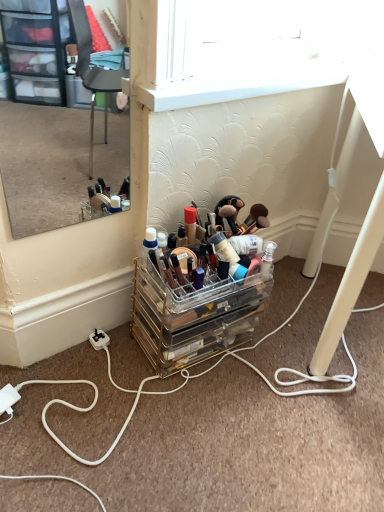
Question: From a real-world perspective, is white cord at lower left below clear acrylic makeup organizer at center?

Choices:
 (A) yes
 (B) no

Answer: (A)

Question: Can you confirm if white cord at lower left is wider than clear acrylic makeup organizer at center?

Choices:
 (A) no
 (B) yes

Answer: (B)

Question: Is white cord at lower left taller than clear acrylic makeup organizer at center?

Choices:
 (A) no
 (B) yes

Answer: (A)

Question: Is white cord at lower left facing towards clear acrylic makeup organizer at center?

Choices:
 (A) yes
 (B) no

Answer: (B)

Question: Is there a large distance between white cord at lower left and clear acrylic makeup organizer at center?

Choices:
 (A) yes
 (B) no

Answer: (B)

Question: Does white cord at lower left contain clear acrylic makeup organizer at center?

Choices:
 (A) no
 (B) yes

Answer: (A)

Question: Is clear acrylic makeup organizer at lower center inside white plastic power outlet at lower left?

Choices:
 (A) yes
 (B) no

Answer: (B)

Question: From a real-world perspective, is white plastic power outlet at lower left on clear acrylic makeup organizer at lower center?

Choices:
 (A) yes
 (B) no

Answer: (B)

Question: From a real-world perspective, is white plastic power outlet at lower left positioned under clear acrylic makeup organizer at lower center based on gravity?

Choices:
 (A) yes
 (B) no

Answer: (A)

Question: Does white plastic power outlet at lower left come behind clear acrylic makeup organizer at lower center?

Choices:
 (A) yes
 (B) no

Answer: (A)

Question: Is white plastic power outlet at lower left beside clear acrylic makeup organizer at lower center?

Choices:
 (A) yes
 (B) no

Answer: (B)

Question: Considering the relative positions of white plastic power outlet at lower left and clear acrylic makeup organizer at lower center in the image provided, is white plastic power outlet at lower left to the right of clear acrylic makeup organizer at lower center from the viewer's perspective?

Choices:
 (A) yes
 (B) no

Answer: (B)

Question: Considering the relative positions of clear acrylic makeup organizer at center and clear acrylic makeup organizer at lower center in the image provided, is clear acrylic makeup organizer at center to the right of clear acrylic makeup organizer at lower center from the viewer's perspective?

Choices:
 (A) yes
 (B) no

Answer: (B)